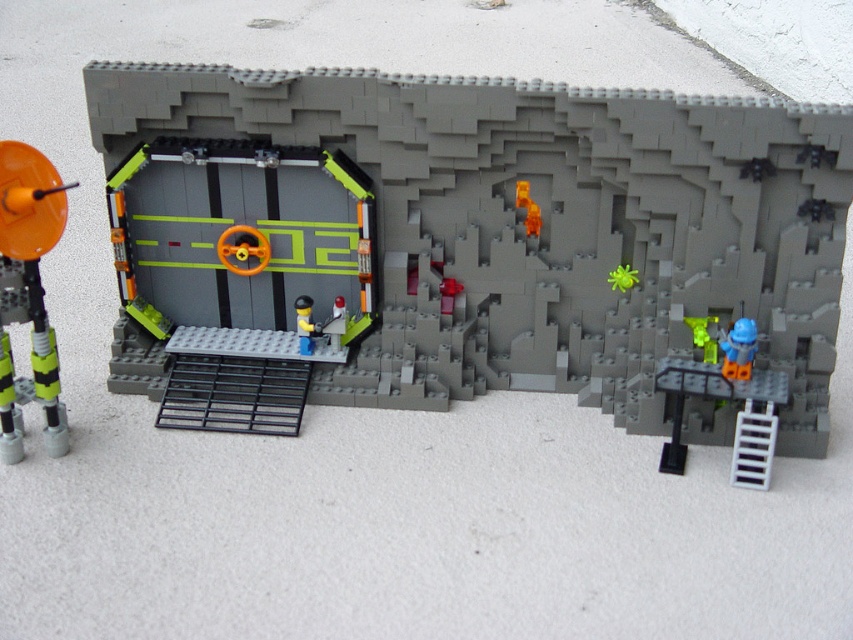
Question: Is matte gray wall at center above orange matte door at center?

Choices:
 (A) no
 (B) yes

Answer: (A)

Question: Can you confirm if matte gray wall at center is positioned below orange matte/soft plastic antenna at left?

Choices:
 (A) no
 (B) yes

Answer: (A)

Question: Which point appears closest to the camera in this image?

Choices:
 (A) tap(534, 209)
 (B) tap(303, 333)
 (C) tap(4, 236)

Answer: (C)

Question: Which object is closer to the camera taking this photo?

Choices:
 (A) orange matte door at center
 (B) light blue plastic figure at center
 (C) smooth plastic figure at center
 (D) matte gray wall at center

Answer: (D)

Question: Which of the following is the closest to the observer?

Choices:
 (A) green matte figure at center
 (B) matte gray wall at center

Answer: (B)

Question: Can you confirm if blue plastic figure at lower right is positioned to the left of light blue plastic figure at center?

Choices:
 (A) no
 (B) yes

Answer: (A)